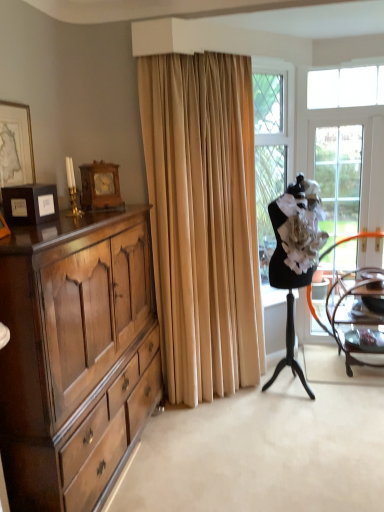
Question: Considering the relative positions of beige velvet curtain at center and white fabric ballet dancer at right in the image provided, is beige velvet curtain at center to the right of white fabric ballet dancer at right from the viewer's perspective?

Choices:
 (A) no
 (B) yes

Answer: (A)

Question: Is white fabric ballet dancer at right located within beige velvet curtain at center?

Choices:
 (A) yes
 (B) no

Answer: (B)

Question: Is beige velvet curtain at center not near white fabric ballet dancer at right?

Choices:
 (A) yes
 (B) no

Answer: (B)

Question: Can you confirm if beige velvet curtain at center is thinner than white fabric ballet dancer at right?

Choices:
 (A) yes
 (B) no

Answer: (A)

Question: Is the depth of beige velvet curtain at center less than that of white fabric ballet dancer at right?

Choices:
 (A) no
 (B) yes

Answer: (B)

Question: From the image's perspective, is beige velvet curtain at center located above or below clear glass screen door at right?

Choices:
 (A) below
 (B) above

Answer: (B)

Question: Looking at their shapes, would you say beige velvet curtain at center is wider or thinner than clear glass screen door at right?

Choices:
 (A) wide
 (B) thin

Answer: (A)

Question: Considering the relative positions of beige velvet curtain at center and clear glass screen door at right in the image provided, is beige velvet curtain at center to the left or to the right of clear glass screen door at right?

Choices:
 (A) left
 (B) right

Answer: (A)

Question: Is beige velvet curtain at center spatially inside clear glass screen door at right, or outside of it?

Choices:
 (A) outside
 (B) inside

Answer: (A)

Question: Is point [21, 154] closer or farther from the camera than point [370, 364]?

Choices:
 (A) closer
 (B) farther

Answer: (A)

Question: Is gold-framed picture at upper left to the left or to the right of wooden chair at right in the image?

Choices:
 (A) left
 (B) right

Answer: (A)

Question: From the image's perspective, is gold-framed picture at upper left located above or below wooden chair at right?

Choices:
 (A) below
 (B) above

Answer: (B)

Question: Do you think gold-framed picture at upper left is within wooden chair at right, or outside of it?

Choices:
 (A) inside
 (B) outside

Answer: (B)

Question: From the image's perspective, is gold-framed picture at upper left located above or below beige velvet curtain at center?

Choices:
 (A) below
 (B) above

Answer: (B)

Question: Considering the positions of gold-framed picture at upper left and beige velvet curtain at center in the image, is gold-framed picture at upper left bigger or smaller than beige velvet curtain at center?

Choices:
 (A) big
 (B) small

Answer: (B)